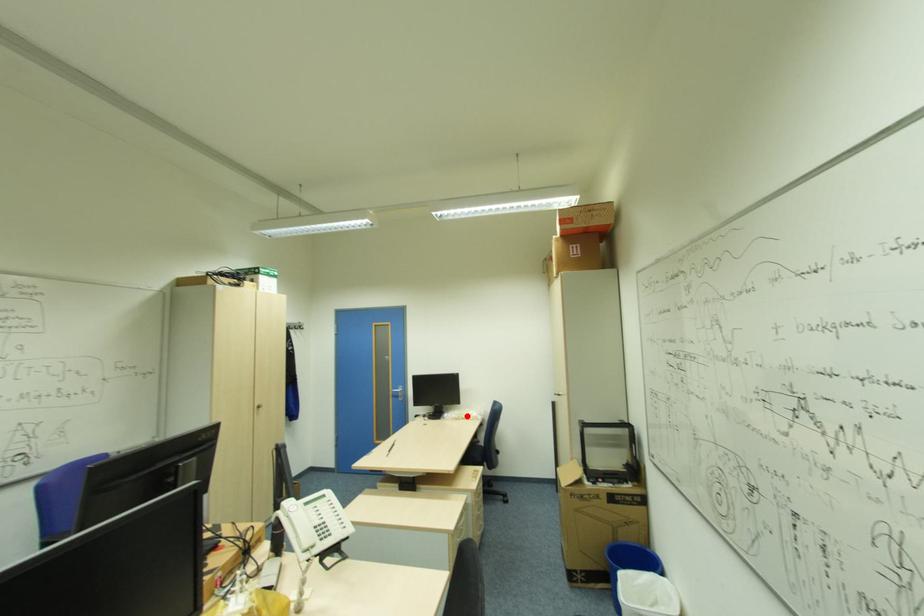
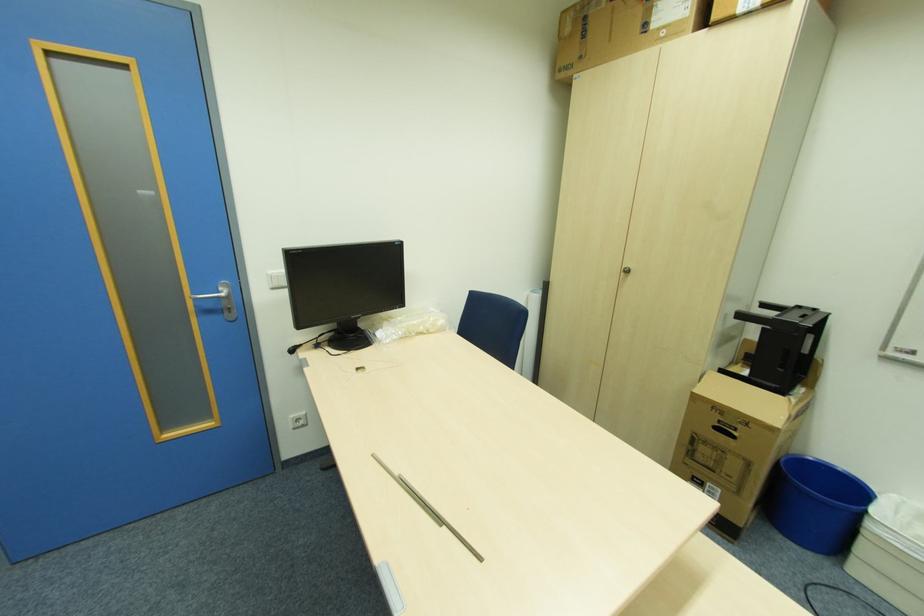
Question: I am providing you with two images of the same scene from different viewpoints. Image1 has a red point marked. In image2, the corresponding 3D location appears at what relative position? Reply with the corresponding letter.

Choices:
 (A) Closer
 (B) Farther

Answer: (A)